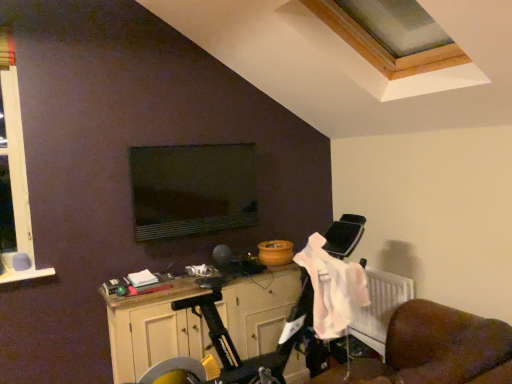
Question: From a real-world perspective, relative to wooden cabinet at lower center, is pink fabric at lower right vertically above or below?

Choices:
 (A) below
 (B) above

Answer: (B)

Question: Looking at the image, does pink fabric at lower right seem bigger or smaller compared to wooden cabinet at lower center?

Choices:
 (A) small
 (B) big

Answer: (A)

Question: Based on their relative distances, which object is nearer to the pink fabric at lower right?

Choices:
 (A) wooden cabinet at lower center
 (B) matte black monitor at center

Answer: (A)

Question: Which is farther from the wooden cabinet at lower center?

Choices:
 (A) pink fabric at lower right
 (B) matte black monitor at center

Answer: (B)